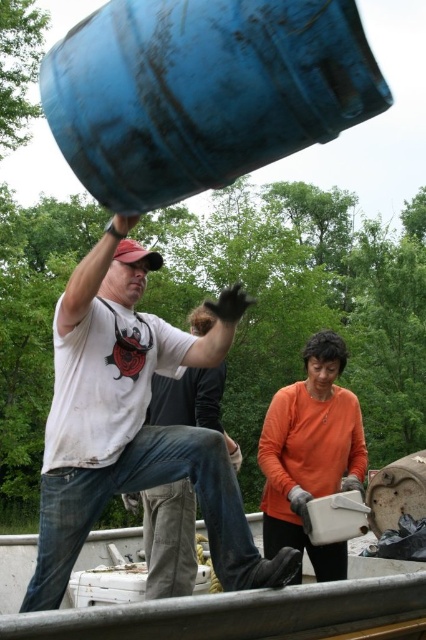
Question: Can you confirm if orange long-sleeve shirt at center is thinner than white t-shirt at center?

Choices:
 (A) no
 (B) yes

Answer: (A)

Question: Which object appears farthest from the camera in this image?

Choices:
 (A) white t-shirt at center
 (B) white matte t-shirt at center
 (C) blue matte barrel at upper center
 (D) orange long-sleeve shirt at center

Answer: (A)

Question: Considering the relative positions of blue matte barrel at upper center and orange long-sleeve shirt at center in the image provided, where is blue matte barrel at upper center located with respect to orange long-sleeve shirt at center?

Choices:
 (A) above
 (B) below

Answer: (A)

Question: Which of the following is the farthest from the observer?

Choices:
 (A) blue matte barrel at upper center
 (B) orange long-sleeve shirt at center

Answer: (B)

Question: Is blue matte barrel at upper center positioned before white matte t-shirt at center?

Choices:
 (A) no
 (B) yes

Answer: (B)

Question: Which point appears farthest from the camera in this image?

Choices:
 (A) (348, 77)
 (B) (232, 588)

Answer: (B)